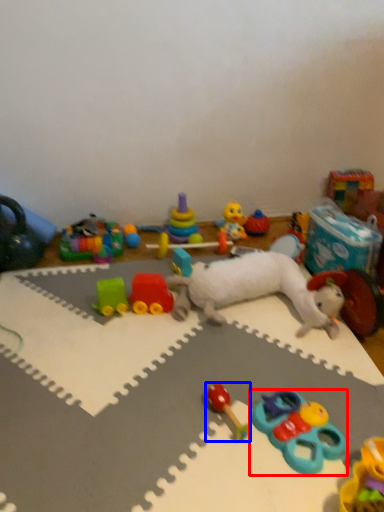
Question: Which point is further to the camera, toy (highlighted by a red box) or toy (highlighted by a blue box)?

Choices:
 (A) toy
 (B) toy

Answer: (B)